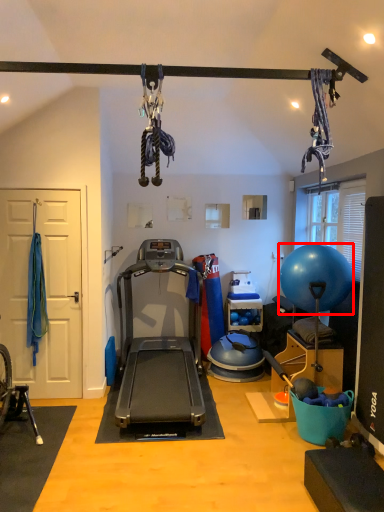
Question: From the image, what is the correct spatial relationship of ball (annotated by the red box) in relation to treadmill?

Choices:
 (A) left
 (B) right

Answer: (B)